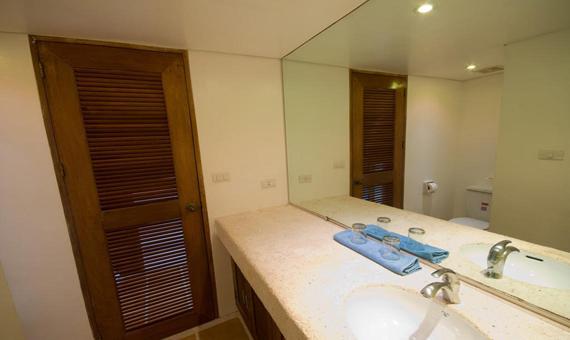
I want to click on reflection of a/c vent in ceiling, so click(x=488, y=68).